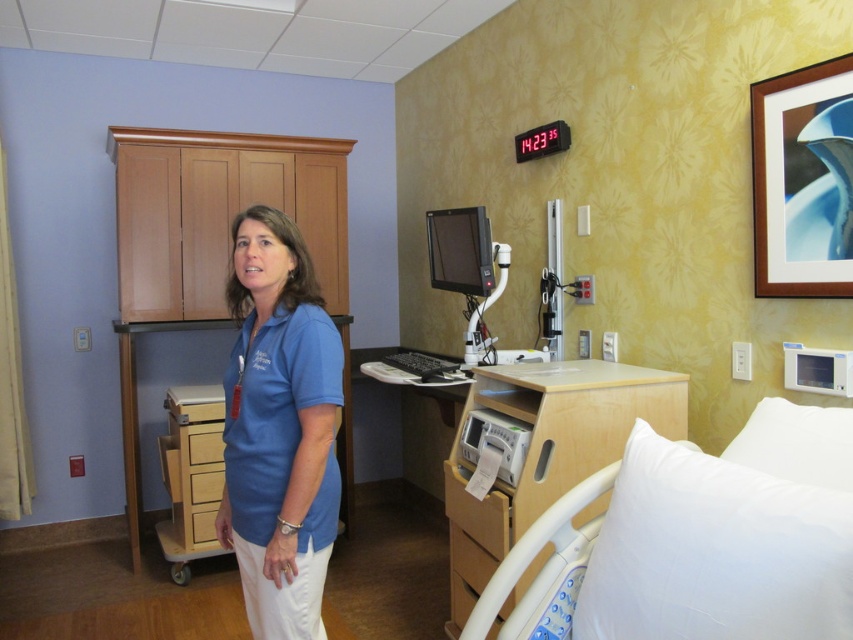
Question: Which point is farther to the camera?

Choices:
 (A) (543, 547)
 (B) (225, 522)

Answer: (B)

Question: From the image, what is the correct spatial relationship of blue cotton shirt at center in relation to white soft hospital bed at lower right?

Choices:
 (A) left
 (B) right

Answer: (A)

Question: Can you confirm if blue cotton shirt at center is bigger than white soft hospital bed at lower right?

Choices:
 (A) yes
 (B) no

Answer: (B)

Question: Is blue cotton shirt at center above white soft hospital bed at lower right?

Choices:
 (A) no
 (B) yes

Answer: (B)

Question: Which point is closer to the camera taking this photo?

Choices:
 (A) (293, 465)
 (B) (786, 403)

Answer: (A)